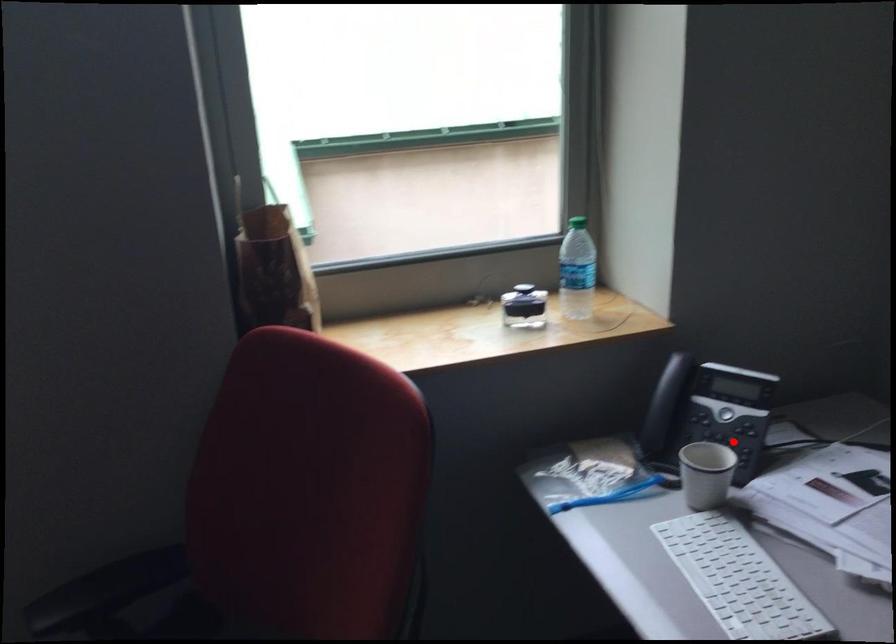
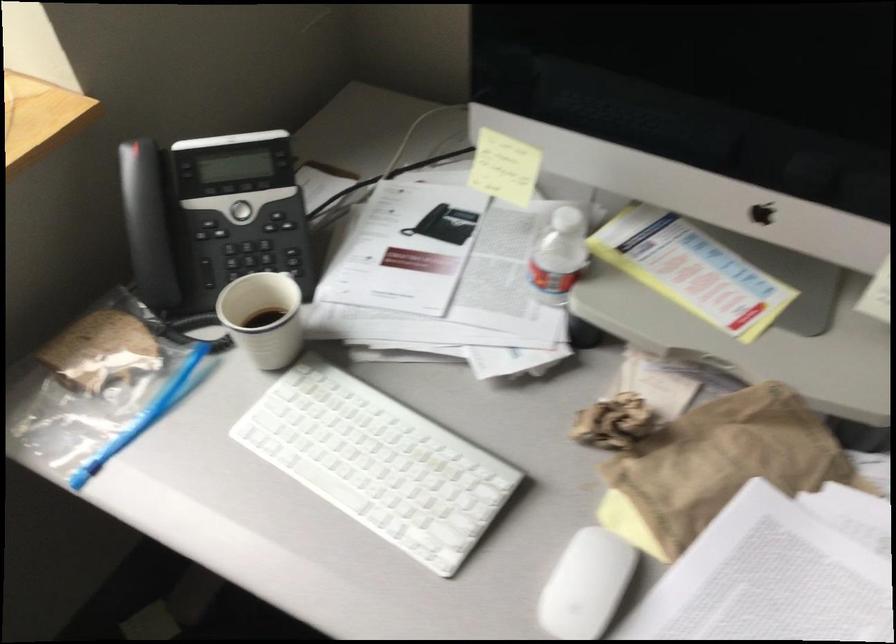
Question: I am providing you with two images of the same scene from different viewpoints. A red point is shown in image1. For the corresponding object point in image2, is it positioned nearer or farther from the camera?

Choices:
 (A) Nearer
 (B) Farther

Answer: (A)